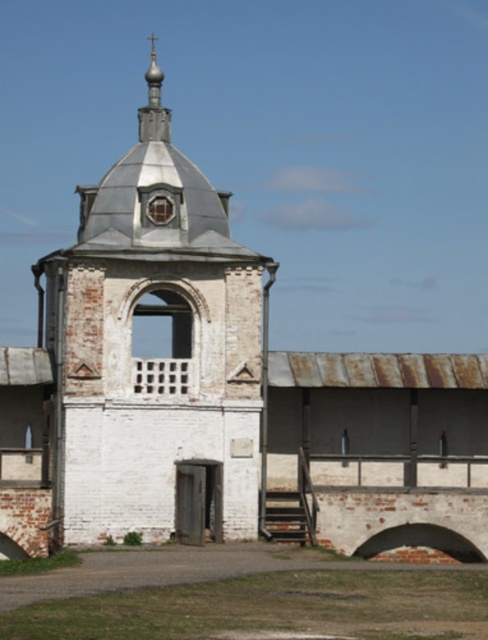
You are standing in front of the historic building described. There is a point marked at coordinates (154,358). Based on the scene, can you identify what architectural feature this point is located on?

The point at coordinates (154,358) is located on the white painted brick tower at center.